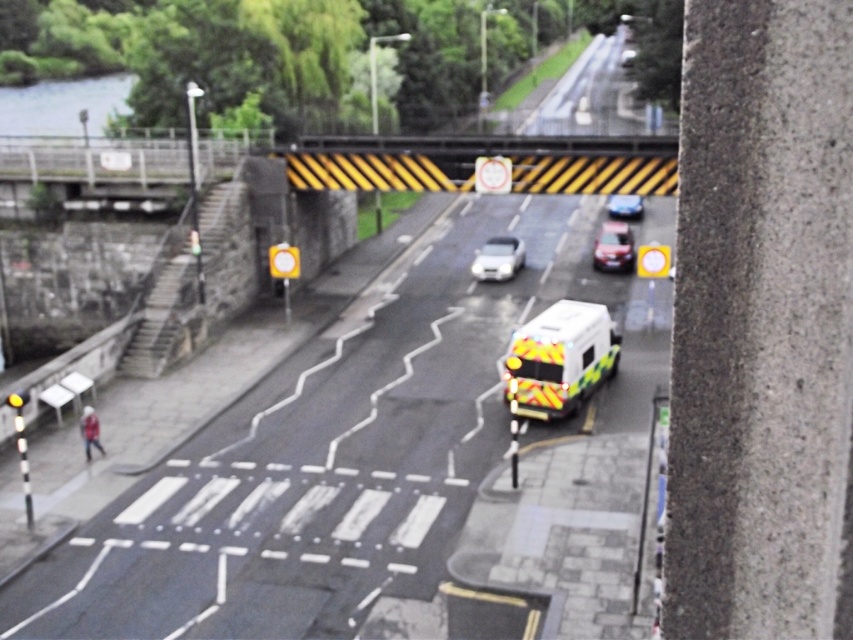
Question: Where is white glossy car at center located in relation to shiny silver car at center in the image?

Choices:
 (A) below
 (B) above

Answer: (A)

Question: Can you confirm if yellow reflective ambulance at center is positioned to the left of yellow reflective van at center?

Choices:
 (A) no
 (B) yes

Answer: (B)

Question: Among these points, which one is nearest to the camera?

Choices:
 (A) (604, 358)
 (B) (10, 604)

Answer: (B)

Question: Which object is the closest to the yellow reflective van at center?

Choices:
 (A) white reflective van at center
 (B) shiny silver car at center

Answer: (B)

Question: Is white reflective van at center below yellow reflective van at center?

Choices:
 (A) yes
 (B) no

Answer: (A)

Question: Which is farther from the yellow reflective ambulance at center?

Choices:
 (A) shiny silver car at center
 (B) white glossy car at center
 (C) yellow reflective van at center

Answer: (A)